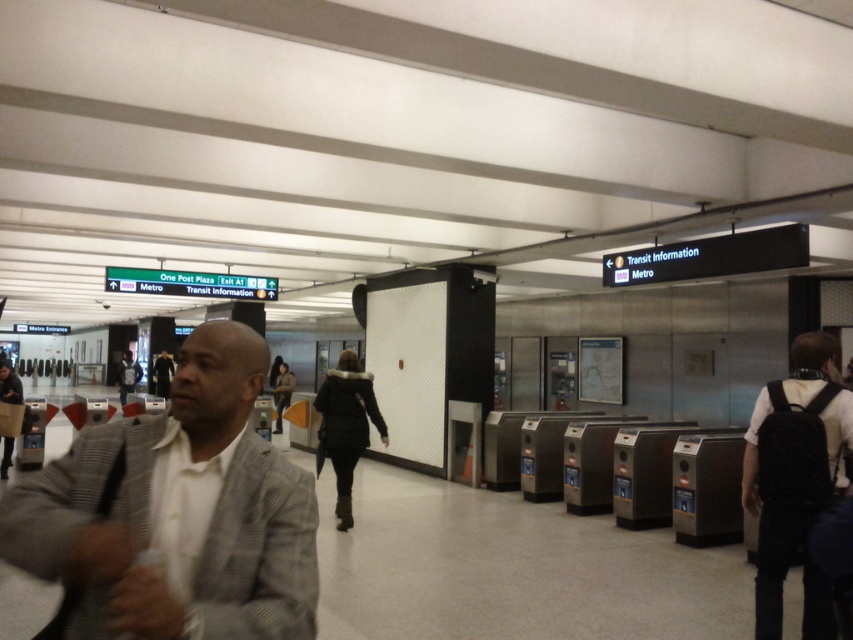
Question: Is gray textured blazer at center wider than black backpack at right?

Choices:
 (A) yes
 (B) no

Answer: (A)

Question: Does gray textured blazer at center have a greater width compared to black backpack at right?

Choices:
 (A) yes
 (B) no

Answer: (A)

Question: Is gray textured blazer at center in front of black backpack at right?

Choices:
 (A) no
 (B) yes

Answer: (B)

Question: Which object is farther from the camera taking this photo?

Choices:
 (A) black backpack at right
 (B) gray textured blazer at center

Answer: (A)